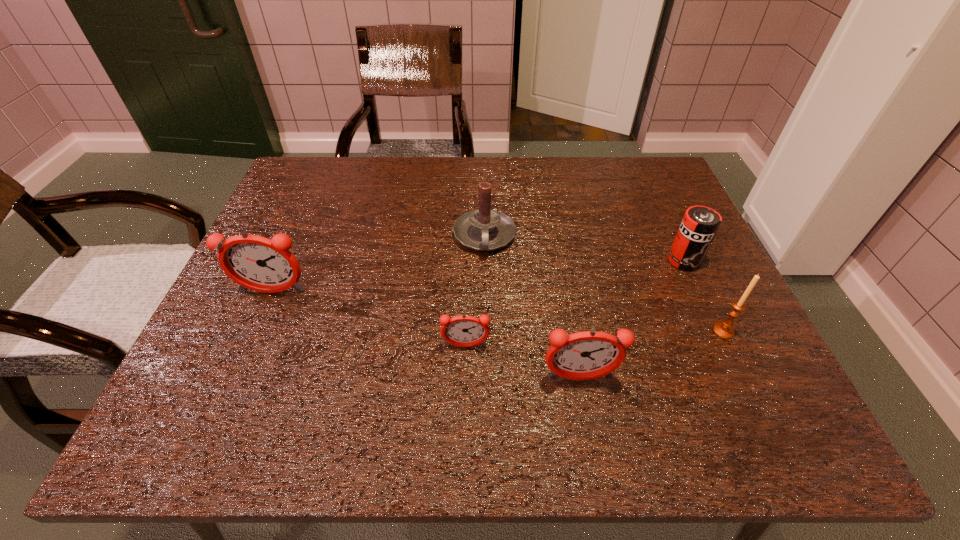
Find the location of a particular element. The width and height of the screenshot is (960, 540). unoccupied area between the leftmost object and the candle_holder is located at coordinates (498, 312).

The height and width of the screenshot is (540, 960). I want to click on free space between the can and the candle, so click(x=585, y=249).

Locate an element on the screen. free spot between the leftmost alarm clock and the candle is located at coordinates (379, 265).

The height and width of the screenshot is (540, 960). What are the coordinates of `free area in between the candle and the can` in the screenshot? It's located at (585, 249).

You are a GUI agent. You are given a task and a screenshot of the screen. Output one action in this format:
    pyautogui.click(x=<x>, y=<y>)
    Task: Click on the vacant region between the candle and the nearest object
    Image resolution: width=960 pixels, height=540 pixels.
    Given the screenshot: What is the action you would take?
    pyautogui.click(x=532, y=308)

Find the location of `object that stands as the fifth closest to the third nearest object`. object that stands as the fifth closest to the third nearest object is located at coordinates (255, 262).

Image resolution: width=960 pixels, height=540 pixels. In order to click on object that is the third closest to the candle in this screenshot , I will do `click(255, 262)`.

Locate which alarm clock ranks third in proximity to the can. Please provide its 2D coordinates. Your answer should be formatted as a tuple, i.e. [(x, y)], where the tuple contains the x and y coordinates of a point satisfying the conditions above.

[(255, 262)]

Where is `alarm clock that is the second closest one to the can`? This screenshot has height=540, width=960. alarm clock that is the second closest one to the can is located at coordinates (463, 331).

At what (x,y) coordinates should I click in order to perform the action: click on blank area in the image that satisfies the following two spatial constraints: 1. on the front-facing side of the candle_holder; 2. on the left side of the leftmost object. Please return your answer as a coordinate pair (x, y). Looking at the image, I should click on (256, 331).